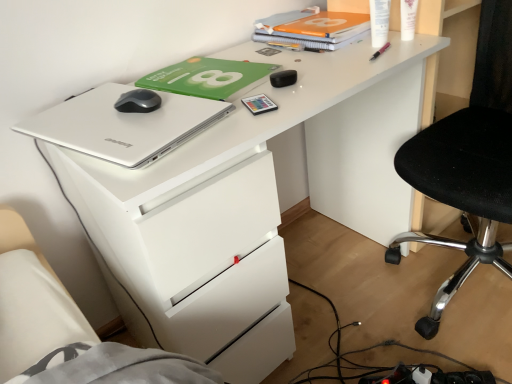
The height and width of the screenshot is (384, 512). I want to click on vacant area that lies in front of white glossy lotion at upper right, marked as the 5th stationery in a left-to-right arrangement, so click(x=400, y=52).